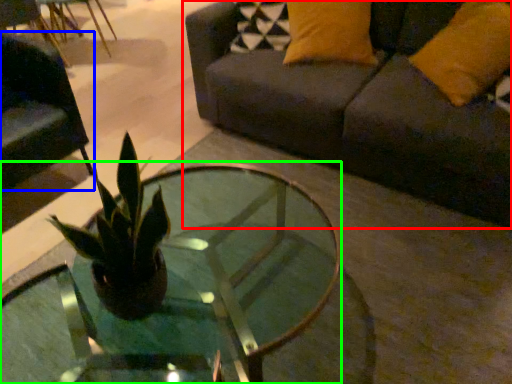
Question: Based on their relative distances, which object is nearer to studio couch (highlighted by a red box)? Choose from swivel chair (highlighted by a blue box) and coffee table (highlighted by a green box).

Choices:
 (A) swivel chair
 (B) coffee table

Answer: (B)